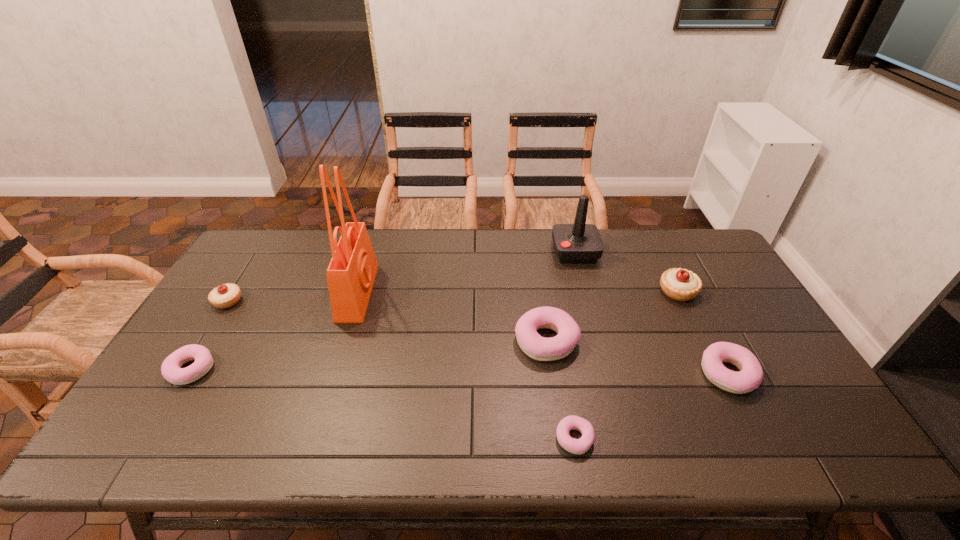
Where is `unoccupied area between the biggest pink pastry and the second smallest pink pastry`? unoccupied area between the biggest pink pastry and the second smallest pink pastry is located at coordinates (369, 355).

Find the location of `vacant space that's between the tallest object and the nearest object`. vacant space that's between the tallest object and the nearest object is located at coordinates (466, 365).

The height and width of the screenshot is (540, 960). What are the coordinates of `vacant area between the seventh shortest object and the third shortest pastry` in the screenshot? It's located at (651, 313).

This screenshot has height=540, width=960. I want to click on empty location between the smallest pink pastry and the smaller beige pastry, so click(401, 369).

You are a GUI agent. You are given a task and a screenshot of the screen. Output one action in this format:
    pyautogui.click(x=<x>, y=<y>)
    Task: Click on the free point between the tallest object and the nearest pink pastry
    
    Given the screenshot: What is the action you would take?
    pyautogui.click(x=466, y=365)

The image size is (960, 540). In order to click on free point between the shortest object and the sixth object from right to left in this screenshot , I will do `click(466, 365)`.

Where is `empty location between the tallest object and the bigger beige pastry`? empty location between the tallest object and the bigger beige pastry is located at coordinates (517, 292).

Identify the location of free space between the biggest pink pastry and the smaller beige pastry. (387, 321).

Locate an element on the screen. Image resolution: width=960 pixels, height=540 pixels. vacant area between the left beige pastry and the tote bag is located at coordinates (293, 297).

The image size is (960, 540). I want to click on the second closest object to the tallest object, so click(x=224, y=296).